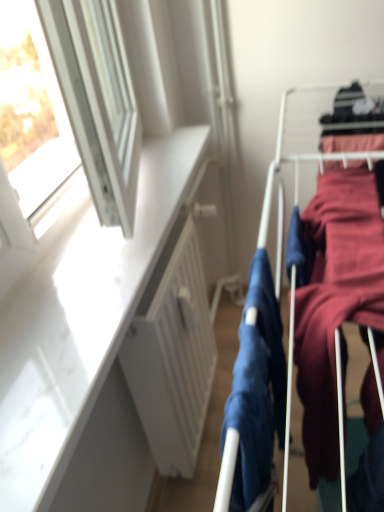
This screenshot has width=384, height=512. Find the location of `matte blue fabric at center, which is counted as the 1th clothing, starting from the left`. matte blue fabric at center, which is counted as the 1th clothing, starting from the left is located at coordinates (254, 395).

The width and height of the screenshot is (384, 512). Describe the element at coordinates (335, 300) in the screenshot. I see `velvet-like maroon dress at right, the second clothing from the left` at that location.

Measure the distance between white matte radiator at center and camera.

34.29 inches.

Locate an element on the screen. matte blue fabric at center, which is counted as the 1th clothing, starting from the left is located at coordinates (254, 395).

Does white matte radiator at center have a greater width compared to matte blue fabric at center, which is counted as the 1th clothing, starting from the left?

Yes.

From the image's perspective, is white matte radiator at center above matte blue fabric at center, which is counted as the 1th clothing, starting from the left?

Incorrect, from the image's perspective, white matte radiator at center is lower than matte blue fabric at center, which is counted as the 1th clothing, starting from the left.

Which object is closer to the camera, white matte radiator at center or matte blue fabric at center, arranged as the 2th clothing when viewed from the right?

matte blue fabric at center, arranged as the 2th clothing when viewed from the right, is closer to the camera.

From a real-world perspective, is white matte radiator at center located beneath matte blue fabric at center, which is counted as the 1th clothing, starting from the left?

Yes, from a real-world perspective, white matte radiator at center is under matte blue fabric at center, which is counted as the 1th clothing, starting from the left.

Looking at this image, are matte blue fabric at center, arranged as the 2th clothing when viewed from the right, and velvet-like maroon dress at right, the second clothing from the left, beside each other?

matte blue fabric at center, arranged as the 2th clothing when viewed from the right, is not next to velvet-like maroon dress at right, the second clothing from the left, and they're not touching.

Would you say matte blue fabric at center, arranged as the 2th clothing when viewed from the right, is outside velvet-like maroon dress at right, the second clothing from the left?

matte blue fabric at center, arranged as the 2th clothing when viewed from the right, lies outside velvet-like maroon dress at right, the second clothing from the left,'s area.

Considering the relative positions of matte blue fabric at center, arranged as the 2th clothing when viewed from the right, and velvet-like maroon dress at right, the second clothing from the left, in the image provided, is matte blue fabric at center, arranged as the 2th clothing when viewed from the right, to the right of velvet-like maroon dress at right, the second clothing from the left, from the viewer's perspective?

In fact, matte blue fabric at center, arranged as the 2th clothing when viewed from the right, is to the left of velvet-like maroon dress at right, the second clothing from the left.

Is matte blue fabric at center, arranged as the 2th clothing when viewed from the right, facing towards velvet-like maroon dress at right, the second clothing from the left?

Yes, matte blue fabric at center, arranged as the 2th clothing when viewed from the right, is oriented towards velvet-like maroon dress at right, the second clothing from the left.

Is there a large distance between velvet-like maroon dress at right, the 1th clothing positioned from the right, and matte blue fabric at center, arranged as the 2th clothing when viewed from the right?

They are positioned close to each other.

How different are the orientations of velvet-like maroon dress at right, the second clothing from the left, and matte blue fabric at center, arranged as the 2th clothing when viewed from the right, in degrees?

The facing directions of velvet-like maroon dress at right, the second clothing from the left, and matte blue fabric at center, arranged as the 2th clothing when viewed from the right, are 0.00456 degrees apart.

Is velvet-like maroon dress at right, the second clothing from the left, oriented away from matte blue fabric at center, which is counted as the 1th clothing, starting from the left?

Yes, velvet-like maroon dress at right, the second clothing from the left, is positioned with its back facing matte blue fabric at center, which is counted as the 1th clothing, starting from the left.

Is velvet-like maroon dress at right, the 1th clothing positioned from the right, positioned beyond the bounds of matte blue fabric at center, which is counted as the 1th clothing, starting from the left?

velvet-like maroon dress at right, the 1th clothing positioned from the right, lies outside matte blue fabric at center, which is counted as the 1th clothing, starting from the left,'s area.

Does matte blue fabric at center, which is counted as the 1th clothing, starting from the left, appear on the left side of white matte radiator at center?

In fact, matte blue fabric at center, which is counted as the 1th clothing, starting from the left, is to the right of white matte radiator at center.

Can you confirm if matte blue fabric at center, which is counted as the 1th clothing, starting from the left, is shorter than white matte radiator at center?

Yes, matte blue fabric at center, which is counted as the 1th clothing, starting from the left, is shorter than white matte radiator at center.

Is matte blue fabric at center, arranged as the 2th clothing when viewed from the right, closer to the viewer compared to white matte radiator at center?

Yes, the depth of matte blue fabric at center, arranged as the 2th clothing when viewed from the right, is less than that of white matte radiator at center.

From a real-world perspective, is white matte radiator at center beneath velvet-like maroon dress at right, the second clothing from the left?

Yes.

In the scene shown: Would you say white matte radiator at center is a long distance from velvet-like maroon dress at right, the 1th clothing positioned from the right?

No, white matte radiator at center is in close proximity to velvet-like maroon dress at right, the 1th clothing positioned from the right.

Is white matte radiator at center in front of or behind velvet-like maroon dress at right, the 1th clothing positioned from the right, in the image?

In the image, white matte radiator at center appears behind velvet-like maroon dress at right, the 1th clothing positioned from the right.

Could you measure the distance between white matte radiator at center and velvet-like maroon dress at right, the second clothing from the left?

They are 15.91 inches apart.

Considering the relative sizes of velvet-like maroon dress at right, the 1th clothing positioned from the right, and white matte radiator at center in the image provided, is velvet-like maroon dress at right, the 1th clothing positioned from the right, shorter than white matte radiator at center?

Indeed, velvet-like maroon dress at right, the 1th clothing positioned from the right, has a lesser height compared to white matte radiator at center.

Which is nearer, (368,179) or (156,316)?

The point (156,316) is more forward.

Could you tell me if velvet-like maroon dress at right, the second clothing from the left, is turned towards white matte radiator at center?

No, velvet-like maroon dress at right, the second clothing from the left, is not oriented towards white matte radiator at center.

Does velvet-like maroon dress at right, the second clothing from the left, have a greater width compared to white matte radiator at center?

Indeed, velvet-like maroon dress at right, the second clothing from the left, has a greater width compared to white matte radiator at center.

The width and height of the screenshot is (384, 512). What are the coordinates of `the 1st clothing counting from the right of the white matte radiator at center` in the screenshot? It's located at (254, 395).

Find the location of a particular element. The width and height of the screenshot is (384, 512). clothing that appears above the velvet-like maroon dress at right, the second clothing from the left (from a real-world perspective) is located at coordinates (254, 395).

Based on their spatial positions, is velvet-like maroon dress at right, the 1th clothing positioned from the right, or white matte radiator at center further from matte blue fabric at center, arranged as the 2th clothing when viewed from the right?

The object further to matte blue fabric at center, arranged as the 2th clothing when viewed from the right, is white matte radiator at center.

Based on their spatial positions, is velvet-like maroon dress at right, the second clothing from the left, or matte blue fabric at center, which is counted as the 1th clothing, starting from the left, closer to white matte radiator at center?

Among the two, matte blue fabric at center, which is counted as the 1th clothing, starting from the left, is located nearer to white matte radiator at center.

Which object lies further to the anchor point velvet-like maroon dress at right, the second clothing from the left, white matte radiator at center or matte blue fabric at center, which is counted as the 1th clothing, starting from the left?

white matte radiator at center lies further to velvet-like maroon dress at right, the second clothing from the left, than the other object.

From the picture: Looking at the image, which one is located further to white matte radiator at center, matte blue fabric at center, arranged as the 2th clothing when viewed from the right, or velvet-like maroon dress at right, the 1th clothing positioned from the right?

Among the two, velvet-like maroon dress at right, the 1th clothing positioned from the right, is located further to white matte radiator at center.

Consider the image. When comparing their distances from matte blue fabric at center, which is counted as the 1th clothing, starting from the left, does white matte radiator at center or velvet-like maroon dress at right, the 1th clothing positioned from the right, seem further?

white matte radiator at center lies further to matte blue fabric at center, which is counted as the 1th clothing, starting from the left, than the other object.

Considering their positions, is matte blue fabric at center, which is counted as the 1th clothing, starting from the left, positioned closer to velvet-like maroon dress at right, the 1th clothing positioned from the right, than white matte radiator at center?

Among the two, matte blue fabric at center, which is counted as the 1th clothing, starting from the left, is located nearer to velvet-like maroon dress at right, the 1th clothing positioned from the right.

Image resolution: width=384 pixels, height=512 pixels. In order to click on clothing between matte blue fabric at center, arranged as the 2th clothing when viewed from the right, and white matte radiator at center in the front-back direction in this screenshot , I will do (335, 300).